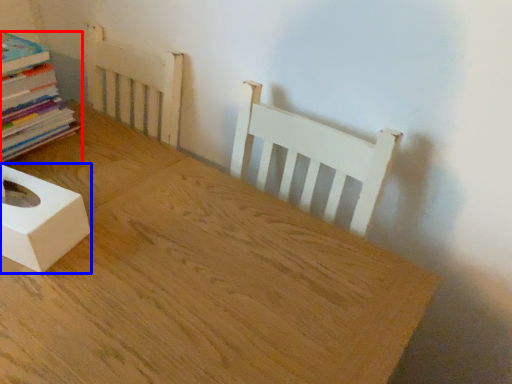
Question: Which of the following is the closest to the observer, book (highlighted by a red box) or box (highlighted by a blue box)?

Choices:
 (A) book
 (B) box

Answer: (B)